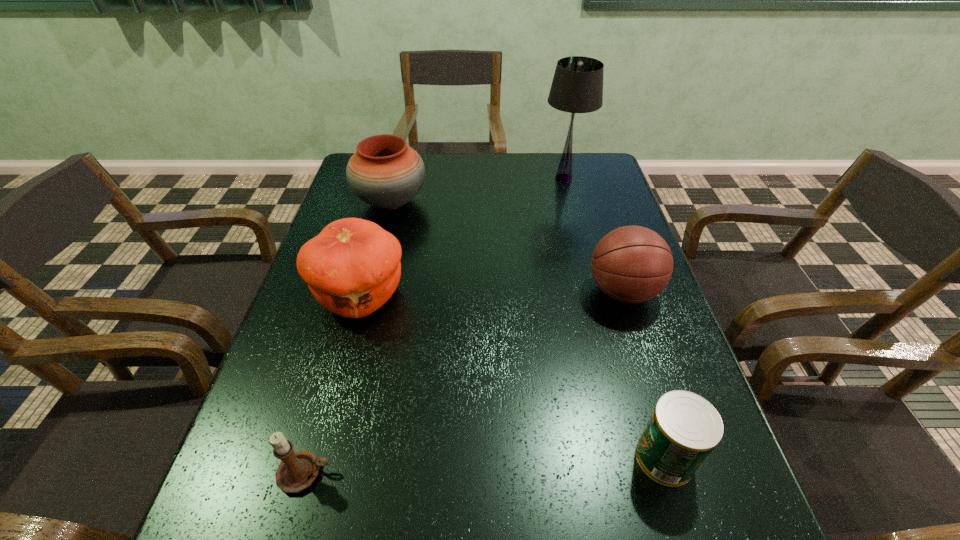
The height and width of the screenshot is (540, 960). What are the coordinates of `basketball that is at the right edge` in the screenshot? It's located at (631, 264).

In order to click on can situated at the right edge in this screenshot , I will do `click(684, 428)`.

At what (x,y) coordinates should I click in order to perform the action: click on object present at the far left corner. Please return your answer as a coordinate pair (x, y). Looking at the image, I should click on (384, 172).

This screenshot has height=540, width=960. What are the coordinates of `object that is at the far right corner` in the screenshot? It's located at (577, 87).

This screenshot has width=960, height=540. I want to click on vacant point at the far edge, so click(426, 155).

This screenshot has height=540, width=960. I want to click on free location at the near edge of the desktop, so click(326, 532).

You are a GUI agent. You are given a task and a screenshot of the screen. Output one action in this format:
    pyautogui.click(x=<x>, y=<y>)
    Task: Click on the vacant space at the left edge of the desktop
    
    Given the screenshot: What is the action you would take?
    291,418

Locate an element on the screen. Image resolution: width=960 pixels, height=540 pixels. vacant space at the right edge of the desktop is located at coordinates (630, 402).

The image size is (960, 540). In order to click on vacant space at the far right corner of the desktop in this screenshot , I will do `click(583, 156)`.

This screenshot has height=540, width=960. Find the location of `free space between the pottery and the basketball`. free space between the pottery and the basketball is located at coordinates (507, 247).